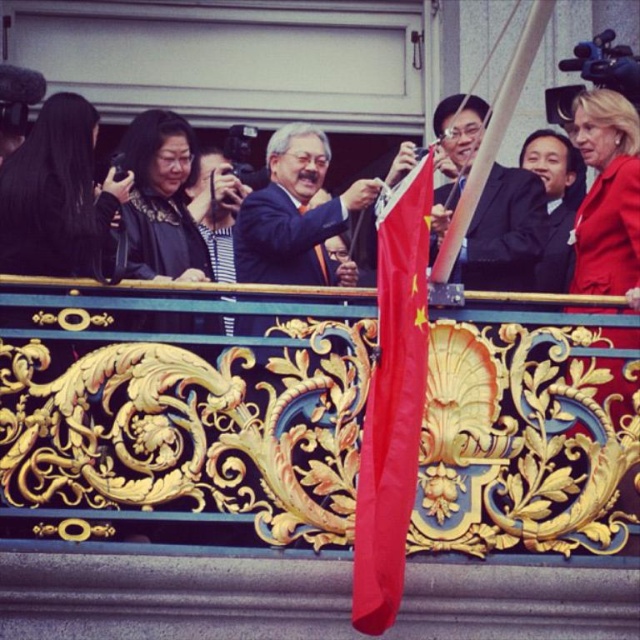
Question: Observing the image, what is the correct spatial positioning of red matte flag at center in reference to smooth black suit at center?

Choices:
 (A) left
 (B) right

Answer: (A)

Question: Which point is farther to the camera?

Choices:
 (A) red matte flag at center
 (B) smooth black suit at center

Answer: (B)

Question: Which point is farther to the camera?

Choices:
 (A) smooth black suit at center
 (B) red matte flag at center

Answer: (A)

Question: Does red matte flag at center lie in front of smooth black suit at center?

Choices:
 (A) no
 (B) yes

Answer: (B)

Question: Does red matte flag at center appear over smooth black suit at center?

Choices:
 (A) no
 (B) yes

Answer: (A)

Question: Which object is farther from the camera taking this photo?

Choices:
 (A) red matte flag at center
 (B) smooth black suit at center

Answer: (B)